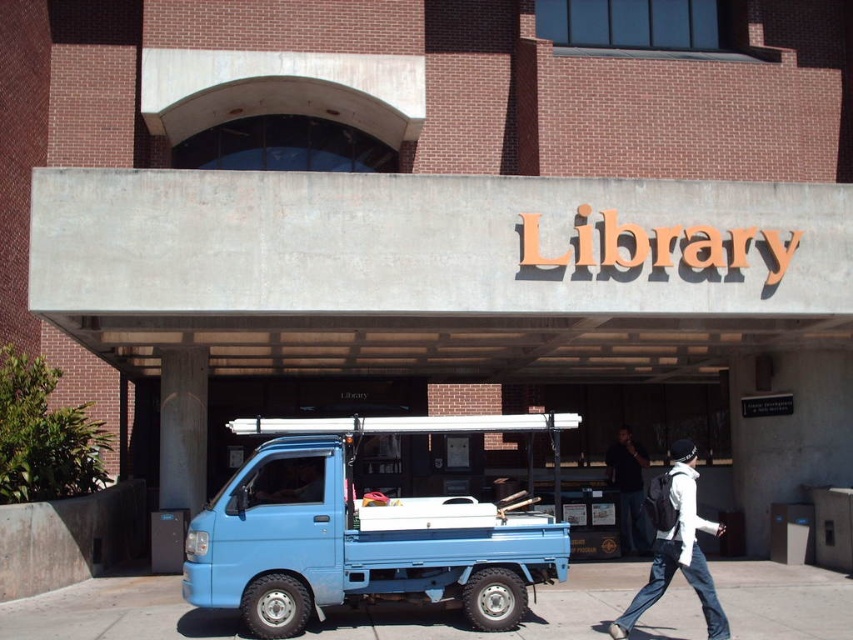
Is white matte jacket at center below dark blue jeans at lower right?

No, white matte jacket at center is not below dark blue jeans at lower right.

Is white matte jacket at center shorter than dark blue jeans at lower right?

Yes.

Is point (674, 541) farther from viewer compared to point (625, 474)?

No, it is not.

Locate an element on the screen. The image size is (853, 640). white matte jacket at center is located at coordinates (676, 545).

Which is below, blue matte truck at lower left or white matte jacket at center?

blue matte truck at lower left is lower down.

Which is behind, point (428, 531) or point (670, 458)?

Point (670, 458)

What are the coordinates of `blue matte truck at lower left` in the screenshot? It's located at (364, 531).

Which is in front, point (3, 616) or point (631, 502)?

Point (3, 616) is more forward.

Does blue concrete pavement at lower center have a larger size compared to dark blue jeans at lower right?

Yes.

Locate an element on the screen. blue concrete pavement at lower center is located at coordinates (114, 612).

At what (x,y) coordinates should I click in order to perform the action: click on blue concrete pavement at lower center. Please return your answer as a coordinate pair (x, y). The image size is (853, 640). Looking at the image, I should click on (114, 612).